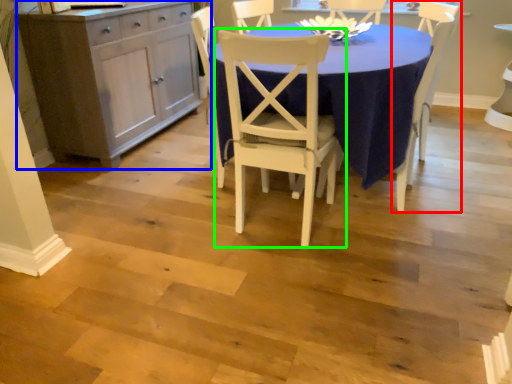
Question: Which object is positioned closest to chair (highlighted by a red box)? Select from cabinetry (highlighted by a blue box) and chair (highlighted by a green box).

Choices:
 (A) cabinetry
 (B) chair

Answer: (B)